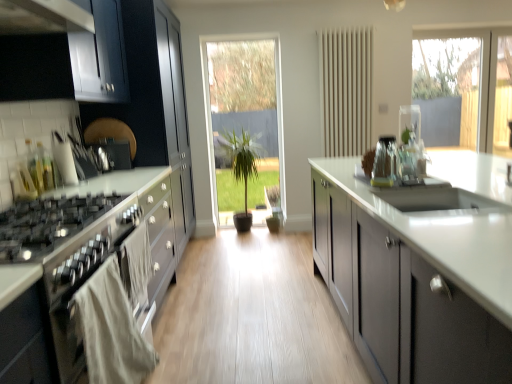
Question: Is point (391, 288) positioned closer to the camera than point (400, 115)?

Choices:
 (A) farther
 (B) closer

Answer: (B)

Question: Is matte gray cabinets at center, the 2th cabinetry when ordered from back to front, inside the boundaries of clear glass vase at upper center, which is counted as the third appliance, starting from the left, or outside?

Choices:
 (A) outside
 (B) inside

Answer: (A)

Question: Which of these objects is positioned closest to the satin black oven at left?

Choices:
 (A) satin silver toaster at upper left, the 1th appliance from the back
 (B) clear glass vase at upper center, acting as the second appliance starting from the front
 (C) matte gray cabinets at center, the 1th cabinetry in the front-to-back sequence
 (D) transparent glass door at center
 (E) matte black cabinets at left, which is counted as the 1th cabinetry, starting from the back

Answer: (C)

Question: Estimate the real-world distances between objects in this image. Which object is farther from the matte black cabinets at left, the first cabinetry in the left-to-right sequence?

Choices:
 (A) transparent glass door at center
 (B) green matte plant at center
 (C) clear glass vase at center, positioned as the third appliance in back-to-front order
 (D) satin black gas stove at left
 (E) satin black oven at left

Answer: (C)